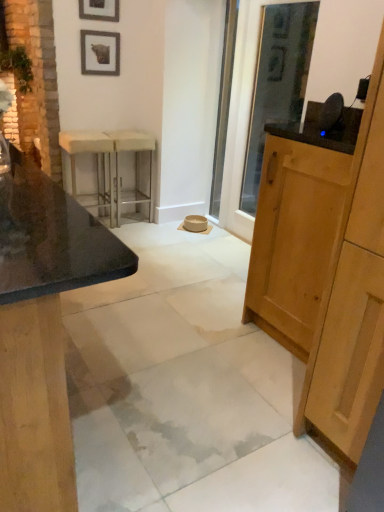
Question: From a real-world perspective, is white marble concrete at center located higher than wooden picture frame at upper center, the 1th picture frame from the bottom?

Choices:
 (A) yes
 (B) no

Answer: (B)

Question: Would you consider white marble concrete at center to be distant from wooden picture frame at upper center, the 2th picture frame from the top?

Choices:
 (A) no
 (B) yes

Answer: (B)

Question: Can you confirm if white marble concrete at center is positioned to the left of wooden picture frame at upper center, the 1th picture frame from the bottom?

Choices:
 (A) no
 (B) yes

Answer: (A)

Question: Is white marble concrete at center looking in the opposite direction of wooden picture frame at upper center, the 1th picture frame from the bottom?

Choices:
 (A) no
 (B) yes

Answer: (A)

Question: Is white marble concrete at center bigger than wooden picture frame at upper center, the 1th picture frame from the bottom?

Choices:
 (A) yes
 (B) no

Answer: (A)

Question: Would you say metallic silver bar stool at center is to the left or to the right of matte stone barstools at left, which is counted as the second cabinetry, starting from the right, in the picture?

Choices:
 (A) left
 (B) right

Answer: (B)

Question: Is point (120, 202) closer or farther from the camera than point (13, 272)?

Choices:
 (A) closer
 (B) farther

Answer: (B)

Question: In terms of height, does metallic silver bar stool at center look taller or shorter compared to matte stone barstools at left, arranged as the first cabinetry when viewed from the left?

Choices:
 (A) short
 (B) tall

Answer: (A)

Question: Relative to matte stone barstools at left, arranged as the first cabinetry when viewed from the left, is metallic silver bar stool at center in front or behind?

Choices:
 (A) behind
 (B) front

Answer: (A)

Question: Is wooden picture frame at upper center, the 2th picture frame from the top, to the left or to the right of matte black picture frame at upper left, marked as the 2th picture frame in a bottom-to-top arrangement, in the image?

Choices:
 (A) right
 (B) left

Answer: (B)

Question: From the image's perspective, is wooden picture frame at upper center, the 1th picture frame from the bottom, positioned above or below matte black picture frame at upper left, marked as the 1th picture frame in a top-to-bottom arrangement?

Choices:
 (A) above
 (B) below

Answer: (B)

Question: Is wooden picture frame at upper center, the 1th picture frame from the bottom, taller or shorter than matte black picture frame at upper left, marked as the 1th picture frame in a top-to-bottom arrangement?

Choices:
 (A) short
 (B) tall

Answer: (A)

Question: From a real-world perspective, is wooden picture frame at upper center, the 1th picture frame from the bottom, physically located above or below matte black picture frame at upper left, marked as the 2th picture frame in a bottom-to-top arrangement?

Choices:
 (A) below
 (B) above

Answer: (A)

Question: From a real-world perspective, is wooden picture frame at upper center, the 1th picture frame from the bottom, positioned above or below white fabric stool at left?

Choices:
 (A) above
 (B) below

Answer: (A)

Question: Considering the relative positions of wooden picture frame at upper center, the 2th picture frame from the top, and white fabric stool at left in the image provided, is wooden picture frame at upper center, the 2th picture frame from the top, to the left or to the right of white fabric stool at left?

Choices:
 (A) left
 (B) right

Answer: (B)